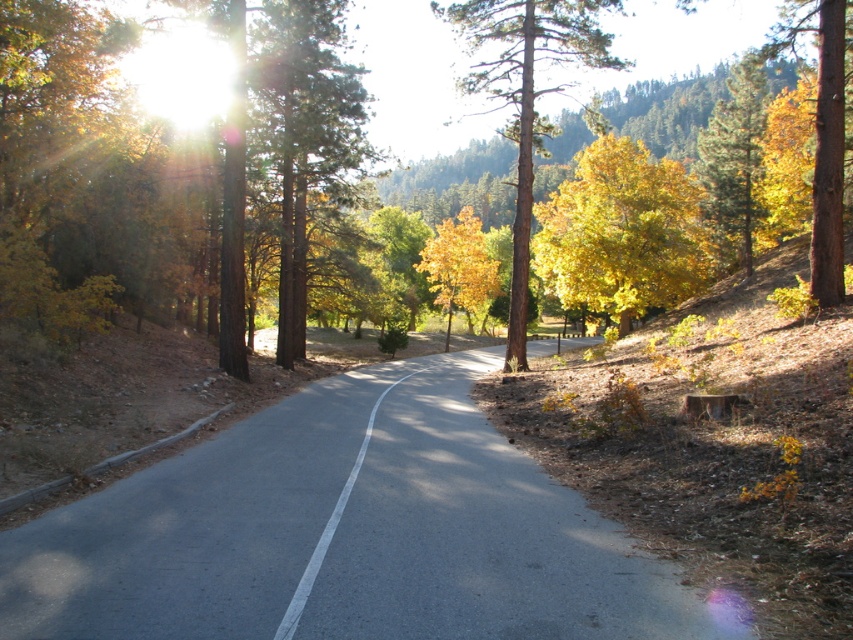
Is point (577, 52) less distant than point (732, 227)?

Yes, it is.

Find the location of `brown textured tree at center`. brown textured tree at center is located at coordinates (71, 157).

Consider the image. Which of these two, golden yellow leaves at center or yellow/golden leaves at center, stands taller?

Standing taller between the two is golden yellow leaves at center.

Consider the image. Is golden yellow leaves at center wider than yellow/golden leaves at center?

Correct, the width of golden yellow leaves at center exceeds that of yellow/golden leaves at center.

The image size is (853, 640). Describe the element at coordinates (526, 99) in the screenshot. I see `golden yellow leaves at center` at that location.

This screenshot has height=640, width=853. In order to click on golden yellow leaves at center in this screenshot , I will do `click(526, 99)`.

Can you confirm if golden yellow leaves at center is bigger than golden yellow leaves at upper right?

Correct, golden yellow leaves at center is larger in size than golden yellow leaves at upper right.

Who is more distant from viewer, (532, 29) or (724, 214)?

The point (724, 214) is behind.

Image resolution: width=853 pixels, height=640 pixels. I want to click on golden yellow leaves at center, so tap(526, 99).